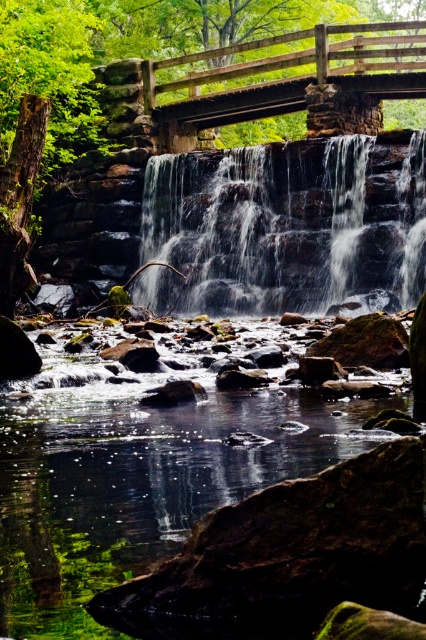
Does point (11, 612) lie in front of point (347, 60)?

Yes, point (11, 612) is closer to viewer.

Which is below, clear water at center or wooden bridge at upper center?

clear water at center is below.

Find the location of a particular element. This screenshot has height=640, width=426. clear water at center is located at coordinates (138, 484).

Locate an element on the screen. clear water at center is located at coordinates (138, 484).

Which is above, clear water at center or dark gray stone waterfall at center?

dark gray stone waterfall at center

Does clear water at center come behind dark gray stone waterfall at center?

No, it is in front of dark gray stone waterfall at center.

Between point (314, 394) and point (157, 211), which one is positioned behind?

The point (157, 211) is more distant.

At what (x,y) coordinates should I click in order to perform the action: click on clear water at center. Please return your answer as a coordinate pair (x, y). Looking at the image, I should click on (138, 484).

Does dark gray stone waterfall at center appear over wooden bridge at upper center?

No.

Between dark gray stone waterfall at center and wooden bridge at upper center, which one has less height?

With less height is dark gray stone waterfall at center.

What do you see at coordinates (284, 227) in the screenshot? I see `dark gray stone waterfall at center` at bounding box center [284, 227].

You are a GUI agent. You are given a task and a screenshot of the screen. Output one action in this format:
    pyautogui.click(x=<x>, y=<y>)
    Task: Click on the dark gray stone waterfall at center
    
    Given the screenshot: What is the action you would take?
    pyautogui.click(x=284, y=227)